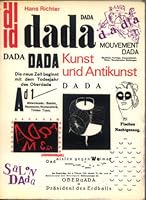
Locate an element on the screen. poster is located at coordinates (57, 93).